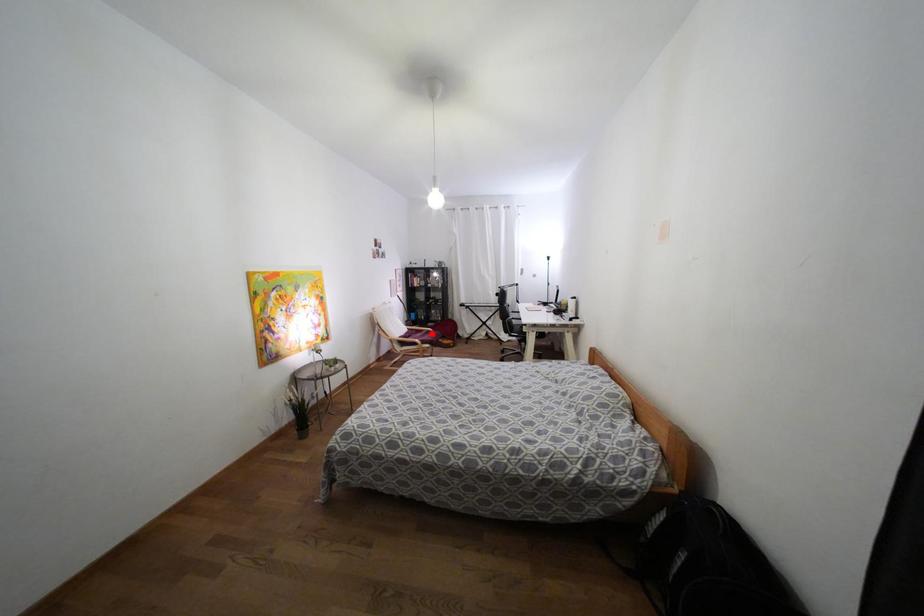
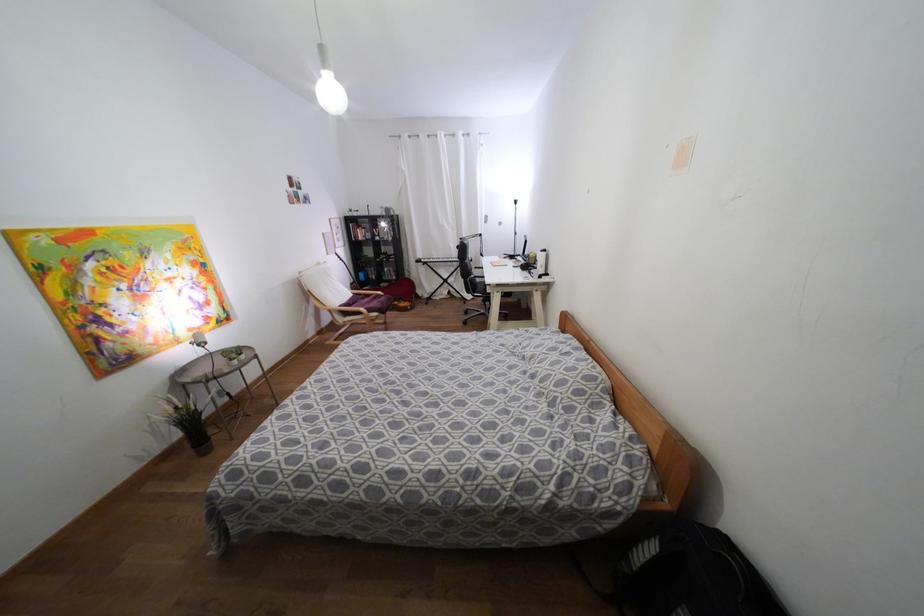
Find the pixel in the second image that matches the highlighted location in the first image.

(382, 299)